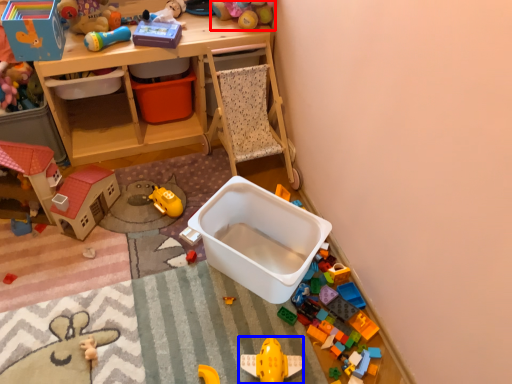
Question: Which object is further to the camera taking this photo, toy (highlighted by a red box) or toy (highlighted by a blue box)?

Choices:
 (A) toy
 (B) toy

Answer: (A)